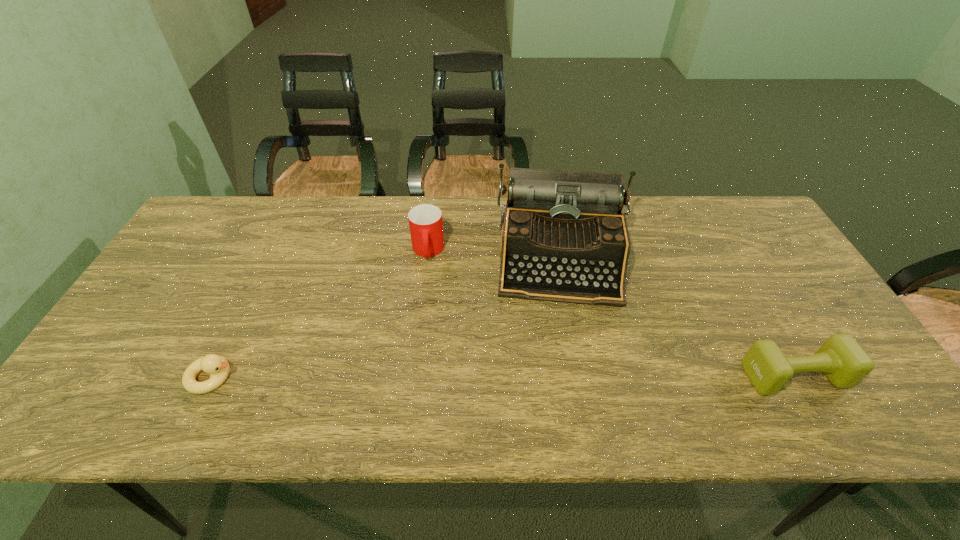
The height and width of the screenshot is (540, 960). What are the coordinates of `vacant space on the desktop that is between the leftmost object and the rightmost object and is positioned on the keyboard of the second object from right to left` in the screenshot? It's located at (568, 376).

You are a GUI agent. You are given a task and a screenshot of the screen. Output one action in this format:
    pyautogui.click(x=<x>, y=<y>)
    Task: Click on the free spot on the desktop that is between the leftmost object and the dumbbell and is positioned on the side of the third shortest object with the handle
    The height and width of the screenshot is (540, 960).
    Given the screenshot: What is the action you would take?
    (421, 376)